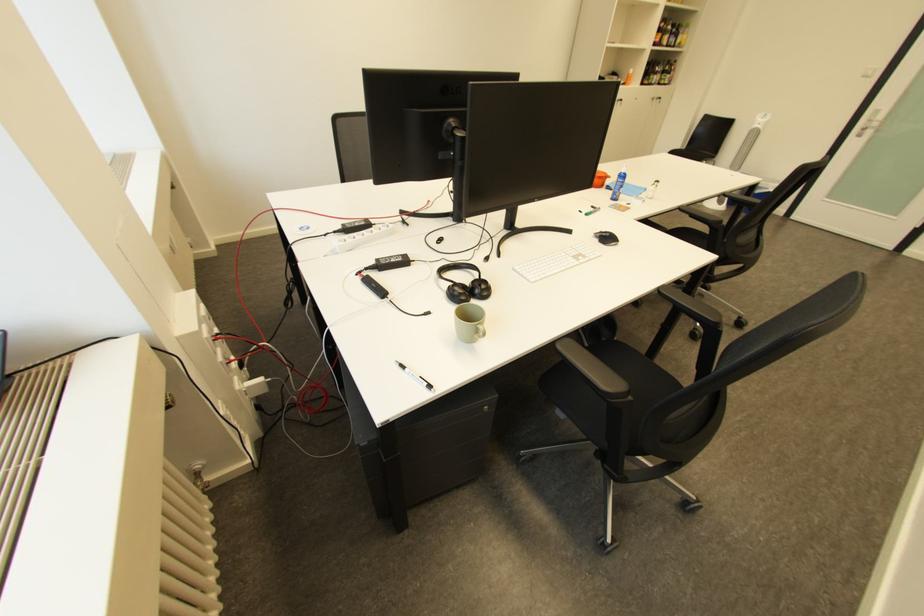
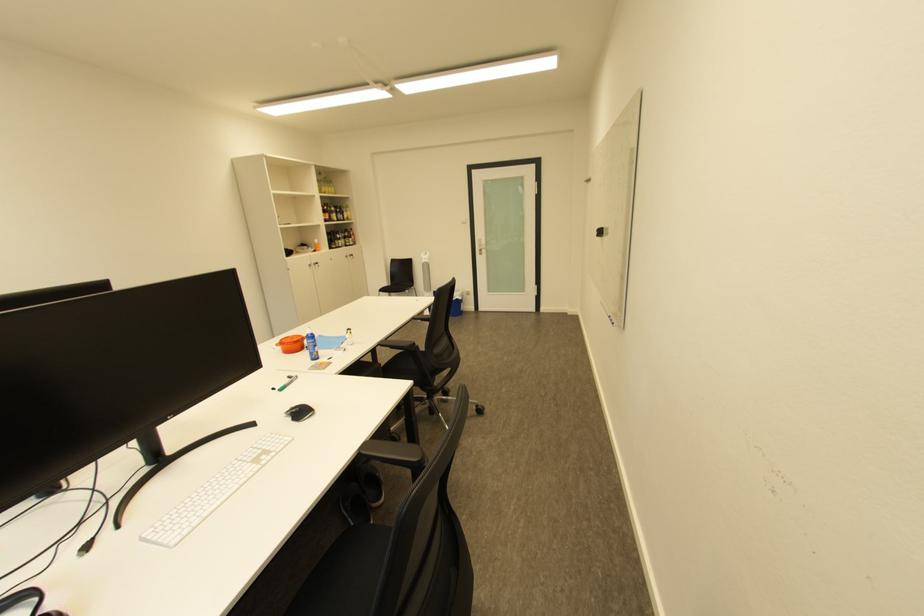
In the second image, find the point that corresponds to the point at 661,51 in the first image.

(335, 225)